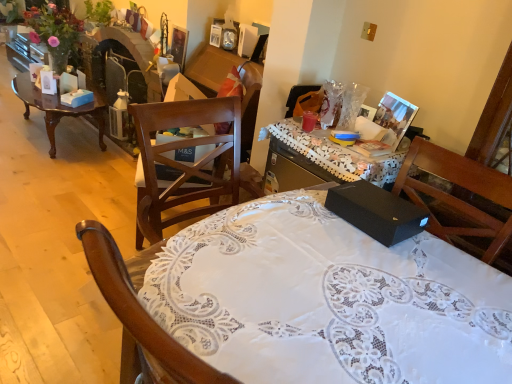
At what (x,y) coordinates should I click in order to perform the action: click on free space above black matte box at center (from a real-world perspective). Please return your answer as a coordinate pair (x, y). Looking at the image, I should click on (373, 194).